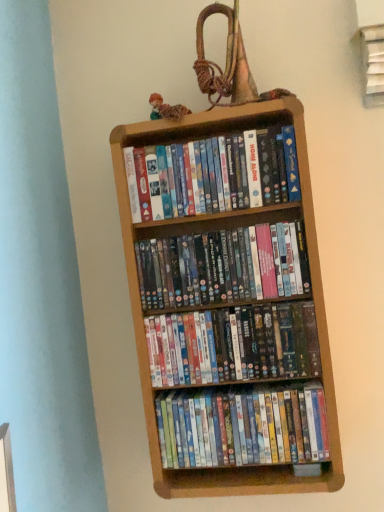
What do you see at coordinates (212, 175) in the screenshot? This screenshot has height=512, width=384. I see `matte plastic dvds at upper center, the 4th book in the bottom-to-top sequence` at bounding box center [212, 175].

At what (x,y) coordinates should I click in order to perform the action: click on matte plastic dvds at center, which is the 4th book from top to bottom. Please return your answer as a coordinate pair (x, y). Looking at the image, I should click on (242, 426).

The image size is (384, 512). What are the coordinates of `multicolored plastic dvds at center, which is counted as the 2th book, starting from the top` in the screenshot? It's located at (223, 266).

How much space does multicolored plastic dvds at center, which is counted as the 2th book, starting from the top, occupy vertically?

multicolored plastic dvds at center, which is counted as the 2th book, starting from the top, is 7.63 inches tall.

Where is `matte plastic dvds at upper center, the first book when ordered from top to bottom`? Image resolution: width=384 pixels, height=512 pixels. matte plastic dvds at upper center, the first book when ordered from top to bottom is located at coordinates (212, 175).

From a real-world perspective, is matte plastic dvds at center, which is the 4th book from top to bottom, on matte plastic dvds at upper center, the first book when ordered from top to bottom?

No, from a real-world perspective, matte plastic dvds at center, which is the 4th book from top to bottom, is not over matte plastic dvds at upper center, the first book when ordered from top to bottom

Locate an element on the screen. The width and height of the screenshot is (384, 512). the 3rd book in front of the matte plastic dvds at center, acting as the 1th book starting from the bottom is located at coordinates (212, 175).

Is matte plastic dvds at center, acting as the 1th book starting from the bottom, placed right next to matte plastic dvds at upper center, the 4th book in the bottom-to-top sequence?

No, matte plastic dvds at center, acting as the 1th book starting from the bottom, is not with matte plastic dvds at upper center, the 4th book in the bottom-to-top sequence.

Considering the relative sizes of matte plastic dvds at center, which is the 4th book from top to bottom, and matte plastic dvds at upper center, the 4th book in the bottom-to-top sequence, in the image provided, is matte plastic dvds at center, which is the 4th book from top to bottom, shorter than matte plastic dvds at upper center, the 4th book in the bottom-to-top sequence,?

Yes, matte plastic dvds at center, which is the 4th book from top to bottom, is shorter than matte plastic dvds at upper center, the 4th book in the bottom-to-top sequence.

Is wooden bookcase at center facing away from multicolored fabric doll at upper center?

No, wooden bookcase at center is not facing away from multicolored fabric doll at upper center.

From a real-world perspective, is wooden bookcase at center positioned above or below multicolored fabric doll at upper center?

Clearly, from a real-world perspective, wooden bookcase at center is below multicolored fabric doll at upper center.

Looking at this image, considering the relative sizes of wooden bookcase at center and multicolored fabric doll at upper center in the image provided, is wooden bookcase at center bigger than multicolored fabric doll at upper center?

Indeed, wooden bookcase at center has a larger size compared to multicolored fabric doll at upper center.

Could you tell me if matte plastic dvds at upper center, the first book when ordered from top to bottom, is turned towards matte plastic dvds at center, positioned as the 2th book in bottom-to-top order?

No, matte plastic dvds at upper center, the first book when ordered from top to bottom, does not turn towards matte plastic dvds at center, positioned as the 2th book in bottom-to-top order.

From a real-world perspective, does matte plastic dvds at upper center, the 4th book in the bottom-to-top sequence, stand above matte plastic dvds at center, positioned as the 2th book in bottom-to-top order?

Yes, from a real-world perspective, matte plastic dvds at upper center, the 4th book in the bottom-to-top sequence, is above matte plastic dvds at center, positioned as the 2th book in bottom-to-top order.

Could matte plastic dvds at center, positioned as the 2th book in bottom-to-top order, be considered to be inside matte plastic dvds at upper center, the 4th book in the bottom-to-top sequence?

Actually, matte plastic dvds at center, positioned as the 2th book in bottom-to-top order, is outside matte plastic dvds at upper center, the 4th book in the bottom-to-top sequence.

How distant is matte plastic dvds at upper center, the 4th book in the bottom-to-top sequence, from matte plastic dvds at center, positioned as the 2th book in bottom-to-top order?

matte plastic dvds at upper center, the 4th book in the bottom-to-top sequence, is 35.37 centimeters from matte plastic dvds at center, positioned as the 2th book in bottom-to-top order.

Considering the points (248, 289) and (235, 439), which point is in front, point (248, 289) or point (235, 439)?

The point (248, 289) is in front.

Is multicolored plastic dvds at center, which is counted as the 2th book, starting from the top, bigger than matte plastic dvds at center, which is the 4th book from top to bottom?

Actually, multicolored plastic dvds at center, which is counted as the 2th book, starting from the top, might be smaller than matte plastic dvds at center, which is the 4th book from top to bottom.

Which object is closer to the camera taking this photo, multicolored plastic dvds at center, which is counted as the 2th book, starting from the top, or matte plastic dvds at center, which is the 4th book from top to bottom?

multicolored plastic dvds at center, which is counted as the 2th book, starting from the top, is in front.

From the multicolored plastic dvds at center, which is counted as the 2th book, starting from the top, count 2nd book to the right and point to it. Please provide its 2D coordinates.

[(242, 426)]

What's the angular difference between multicolored fabric doll at upper center and matte plastic dvds at center, positioned as the 2th book in bottom-to-top order,'s facing directions?

3.23 degrees separate the facing orientations of multicolored fabric doll at upper center and matte plastic dvds at center, positioned as the 2th book in bottom-to-top order.

Is multicolored fabric doll at upper center closer to camera compared to matte plastic dvds at center, which is counted as the 3th book, starting from the top?

That is False.

Considering the relative sizes of multicolored fabric doll at upper center and matte plastic dvds at center, which is counted as the 3th book, starting from the top, in the image provided, is multicolored fabric doll at upper center bigger than matte plastic dvds at center, which is counted as the 3th book, starting from the top,?

No.

Can you confirm if multicolored fabric doll at upper center is thinner than matte plastic dvds at center, which is counted as the 3th book, starting from the top?

Yes.

Is point (297, 449) farther from camera compared to point (213, 239)?

Yes, it is.

Based on the photo, from a real-world perspective, is matte plastic dvds at center, which is the 4th book from top to bottom, above or below multicolored plastic dvds at center, the 3th book when ordered from bottom to top?

From a real-world perspective, matte plastic dvds at center, which is the 4th book from top to bottom, is physically below multicolored plastic dvds at center, the 3th book when ordered from bottom to top.

Considering the positions of objects matte plastic dvds at center, which is the 4th book from top to bottom, and multicolored plastic dvds at center, which is counted as the 2th book, starting from the top, in the image provided, who is behind, matte plastic dvds at center, which is the 4th book from top to bottom, or multicolored plastic dvds at center, which is counted as the 2th book, starting from the top,?

matte plastic dvds at center, which is the 4th book from top to bottom.

Can you tell me how much multicolored fabric doll at upper center and matte plastic dvds at center, acting as the 1th book starting from the bottom, differ in facing direction?

3.23 degrees.

Between multicolored fabric doll at upper center and matte plastic dvds at center, which is the 4th book from top to bottom, which one has less height?

With less height is multicolored fabric doll at upper center.

Looking at their sizes, would you say multicolored fabric doll at upper center is wider or thinner than matte plastic dvds at center, acting as the 1th book starting from the bottom?

multicolored fabric doll at upper center is thinner than matte plastic dvds at center, acting as the 1th book starting from the bottom.

From a real-world perspective, which book is the 3rd one above the matte plastic dvds at center, acting as the 1th book starting from the bottom? Please provide its 2D coordinates.

[(212, 175)]

Find the location of a particular element. This screenshot has width=384, height=512. toy behind the wooden bookcase at center is located at coordinates (166, 109).

Considering their positions, is multicolored plastic dvds at center, which is counted as the 2th book, starting from the top, positioned closer to wooden bookcase at center than multicolored fabric doll at upper center?

The object closer to wooden bookcase at center is multicolored plastic dvds at center, which is counted as the 2th book, starting from the top.

From the image, which object appears to be nearer to matte plastic dvds at center, positioned as the 2th book in bottom-to-top order, matte plastic dvds at upper center, the first book when ordered from top to bottom, or wooden bookcase at center?

wooden bookcase at center lies closer to matte plastic dvds at center, positioned as the 2th book in bottom-to-top order, than the other object.

Based on their spatial positions, is wooden bookcase at center or multicolored fabric doll at upper center closer to matte plastic dvds at upper center, the first book when ordered from top to bottom?

wooden bookcase at center lies closer to matte plastic dvds at upper center, the first book when ordered from top to bottom, than the other object.

Which object lies nearer to the anchor point matte plastic dvds at upper center, the 4th book in the bottom-to-top sequence, multicolored fabric doll at upper center or matte plastic dvds at center, acting as the 1th book starting from the bottom?

multicolored fabric doll at upper center is positioned closer to the anchor matte plastic dvds at upper center, the 4th book in the bottom-to-top sequence.

Based on their spatial positions, is multicolored fabric doll at upper center or multicolored plastic dvds at center, the 3th book when ordered from bottom to top, closer to wooden bookcase at center?

multicolored plastic dvds at center, the 3th book when ordered from bottom to top, lies closer to wooden bookcase at center than the other object.

From the image, which object appears to be farther from wooden bookcase at center, multicolored plastic dvds at center, which is counted as the 2th book, starting from the top, or matte plastic dvds at center, which is counted as the 3th book, starting from the top?

matte plastic dvds at center, which is counted as the 3th book, starting from the top, is positioned further to the anchor wooden bookcase at center.

Considering their positions, is multicolored fabric doll at upper center positioned closer to matte plastic dvds at center, which is the 4th book from top to bottom, than wooden bookcase at center?

Among the two, wooden bookcase at center is located nearer to matte plastic dvds at center, which is the 4th book from top to bottom.

In the scene shown: From the image, which object appears to be nearer to matte plastic dvds at center, acting as the 1th book starting from the bottom, multicolored fabric doll at upper center or multicolored plastic dvds at center, the 3th book when ordered from bottom to top?

multicolored plastic dvds at center, the 3th book when ordered from bottom to top, lies closer to matte plastic dvds at center, acting as the 1th book starting from the bottom, than the other object.

You are a GUI agent. You are given a task and a screenshot of the screen. Output one action in this format:
    pyautogui.click(x=<x>, y=<y>)
    Task: Click on the bookcase that lies between multicolored plastic dvds at center, the 3th book when ordered from bottom to top, and matte plastic dvds at center, positioned as the 2th book in bottom-to-top order, from top to bottom
    Image resolution: width=384 pixels, height=512 pixels.
    Given the screenshot: What is the action you would take?
    [209, 229]

The height and width of the screenshot is (512, 384). In order to click on bookcase between matte plastic dvds at upper center, the first book when ordered from top to bottom, and matte plastic dvds at center, acting as the 1th book starting from the bottom, in the up-down direction in this screenshot , I will do `click(209, 229)`.

Image resolution: width=384 pixels, height=512 pixels. Identify the location of book between matte plastic dvds at upper center, the first book when ordered from top to bottom, and wooden bookcase at center vertically. (223, 266).

Image resolution: width=384 pixels, height=512 pixels. Identify the location of book that lies between matte plastic dvds at upper center, the first book when ordered from top to bottom, and matte plastic dvds at center, which is counted as the 3th book, starting from the top, from top to bottom. (223, 266).